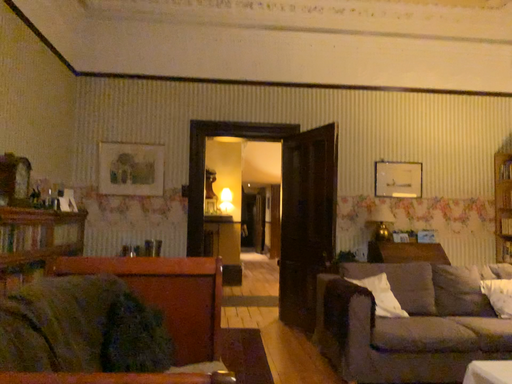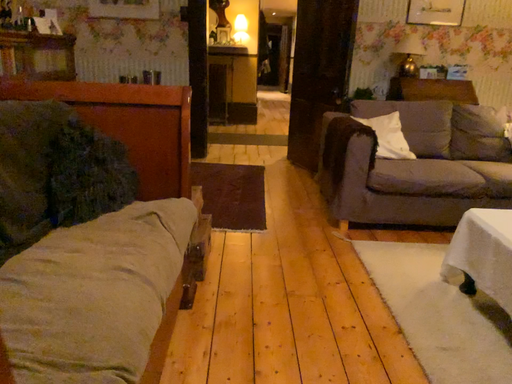
Question: Which way did the camera rotate in the video?

Choices:
 (A) rotated upward
 (B) rotated downward

Answer: (B)